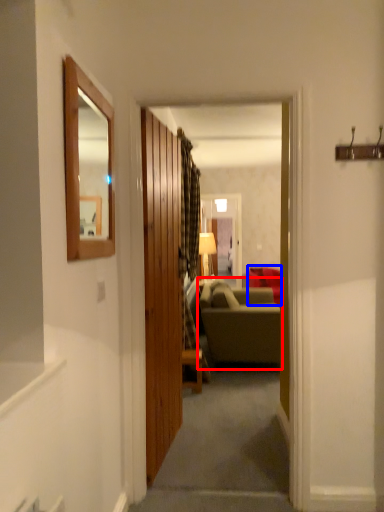
Question: Among these objects, which one is farthest to the camera, studio couch (highlighted by a red box) or studio couch (highlighted by a blue box)?

Choices:
 (A) studio couch
 (B) studio couch

Answer: (B)